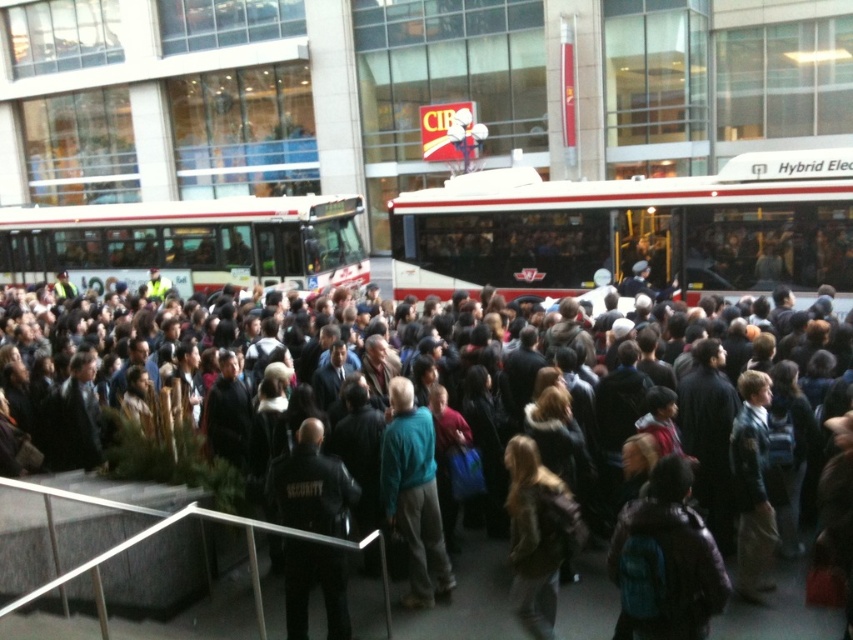
Based on the photo, you are a photographer trying to capture a clear shot of the white hybrid bus at center and the black leather jacket at center. Since the crowd is dense, you need to know which object is larger to choose your camera settings. Which object should you focus on first to ensure proper focus?

The white hybrid bus at center is bigger than the black leather jacket at center, so you should focus on the white hybrid bus at center first to ensure proper focus.

You are a delivery person needing to navigate through the crowd in the urban scene. You must pass between the black leather jacket at center and the teal fabric jacket at center. Your delivery cart is 28 inches wide. Can you fit through the space between them?

The black leather jacket at center is 29.06 inches away from the teal fabric jacket at center. Since the distance between them is greater than the cart width of 28 inches, the delivery cart can fit through the space between them.

Consider the image. You are a photographer standing at the center of the scene. You want to capture a photo of the black leather jacket at center without including any buses in the background. Is the location of the point at coordinates point (x=311, y=484) suitable for this purpose?

The point (x=311, y=484) corresponds to the black leather jacket at center. Since the buses are located in the midground and the jacket is at the center, the photographer can position themselves to frame the jacket while avoiding the buses in the background by adjusting the camera angle or moving slightly to the side.